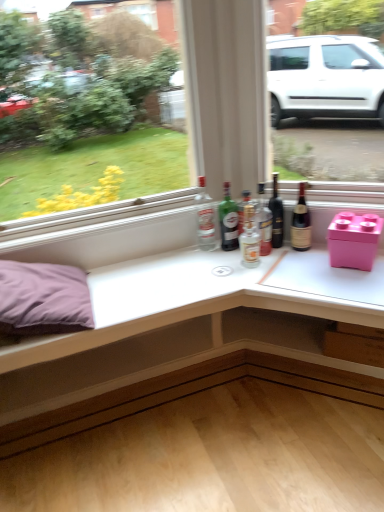
Locate an element on the screen. The height and width of the screenshot is (512, 384). vacant space in between translucent glass bottle at center, acting as the 2th bottle starting from the right, and pink plastic storage box at right is located at coordinates (297, 257).